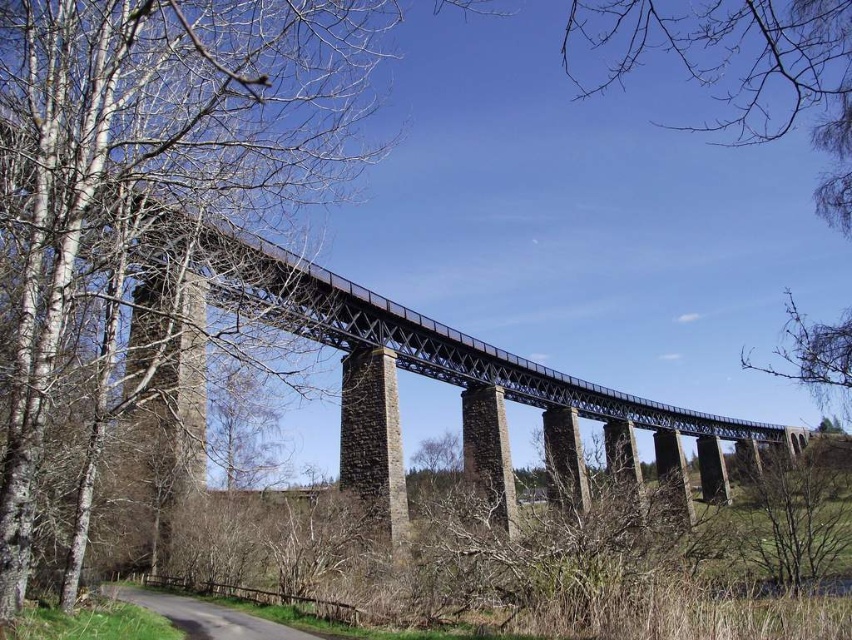
Between bare wood tree at left and brown stone bridge at center, which one is positioned higher?

bare wood tree at left is above.

Does bare wood tree at left come in front of brown stone bridge at center?

No, it is behind brown stone bridge at center.

Describe the element at coordinates (150, 156) in the screenshot. I see `bare wood tree at left` at that location.

Image resolution: width=852 pixels, height=640 pixels. What are the coordinates of `bare wood tree at left` in the screenshot? It's located at (150, 156).

Does bare wood tree at left have a larger size compared to bare branches at upper center?

Actually, bare wood tree at left might be smaller than bare branches at upper center.

Does bare wood tree at left appear under bare branches at upper center?

Correct, bare wood tree at left is located below bare branches at upper center.

Is point (9, 81) closer to camera compared to point (821, 200)?

Yes.

The height and width of the screenshot is (640, 852). What are the coordinates of `bare wood tree at left` in the screenshot? It's located at (150, 156).

Which is above, brown stone bridge at center or bare branches at upper center?

Positioned higher is bare branches at upper center.

Between brown stone bridge at center and bare branches at upper center, which one has less height?

With less height is brown stone bridge at center.

Between point (190, 371) and point (839, 4), which one is positioned behind?

The point (839, 4) is more distant.

What are the coordinates of `brown stone bridge at center` in the screenshot? It's located at (361, 364).